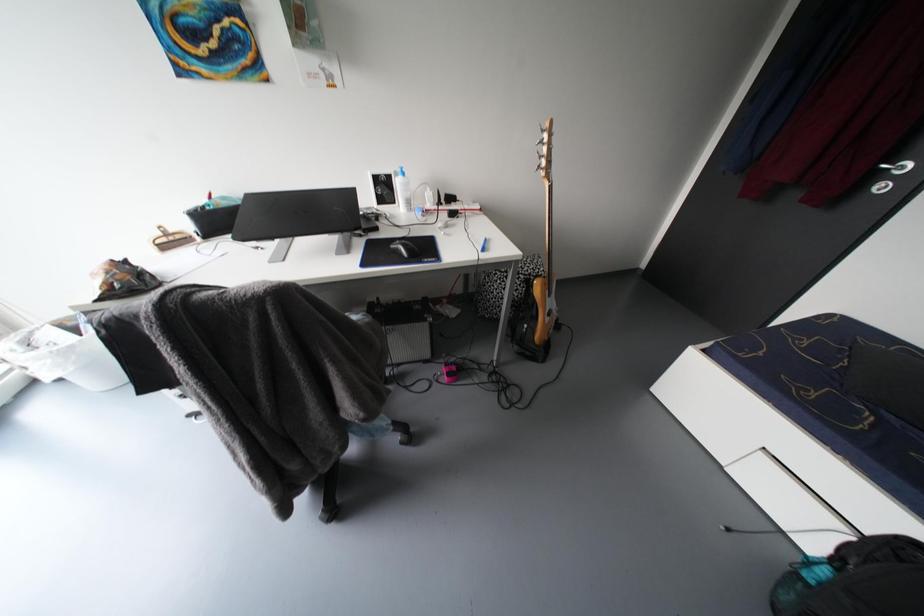
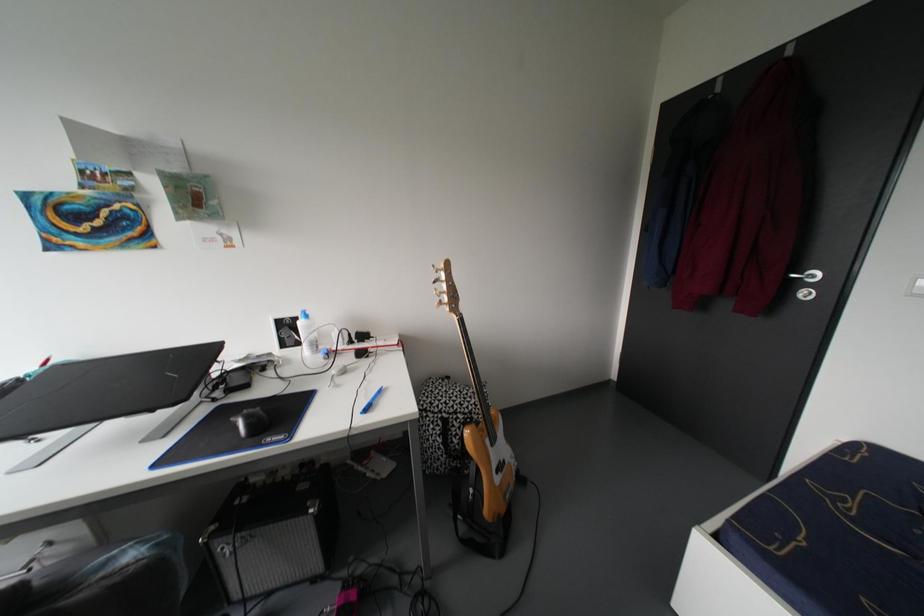
In a continuous first-person perspective shot, in which direction is the camera moving?

The cameraman moved toward right, forward.